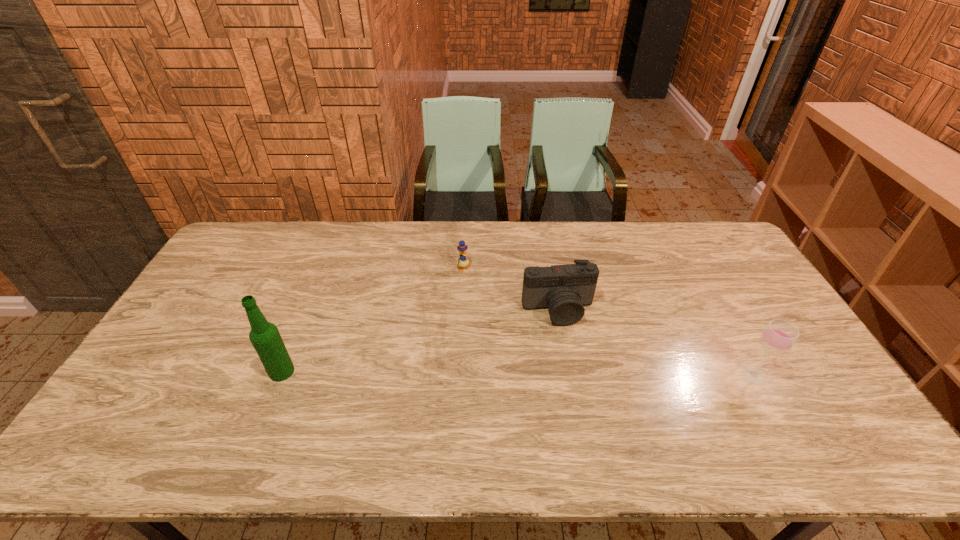
Identify the location of vacant space at the near edge of the desktop. (406, 411).

The image size is (960, 540). In the image, there is a desktop. What are the coordinates of `vacant space at the left edge` in the screenshot? It's located at (248, 284).

At what (x,y) coordinates should I click in order to perform the action: click on blank space at the right edge of the desktop. Please return your answer as a coordinate pair (x, y). Looking at the image, I should click on (731, 269).

Image resolution: width=960 pixels, height=540 pixels. Identify the location of blank area at the far left corner. (225, 252).

This screenshot has height=540, width=960. In order to click on blank region between the shortest object and the third nearest object in this screenshot , I will do `click(511, 289)`.

Identify the location of free space between the second shortest object and the rightmost object. click(x=656, y=343).

This screenshot has width=960, height=540. What are the coordinates of `vacant space in between the leftmost object and the second tallest object` in the screenshot? It's located at (517, 374).

The image size is (960, 540). In order to click on unoccupied area between the beer bottle and the duckling in this screenshot , I will do `click(372, 320)`.

This screenshot has width=960, height=540. What are the coordinates of `unoccupied position between the rightmost object and the third nearest object` in the screenshot? It's located at (656, 343).

You are a GUI agent. You are given a task and a screenshot of the screen. Output one action in this format:
    pyautogui.click(x=<x>, y=<y>)
    Task: Click on the blank region between the farthest object and the third object from left to right
    This screenshot has height=540, width=960.
    Given the screenshot: What is the action you would take?
    pyautogui.click(x=511, y=289)